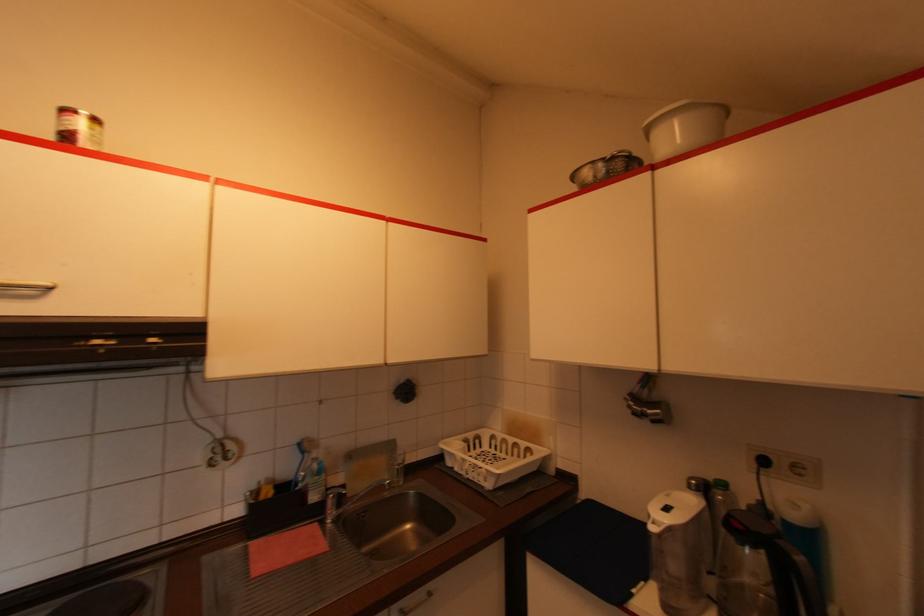
The location [79,128] corresponds to which object?

It corresponds to the food can in the image.